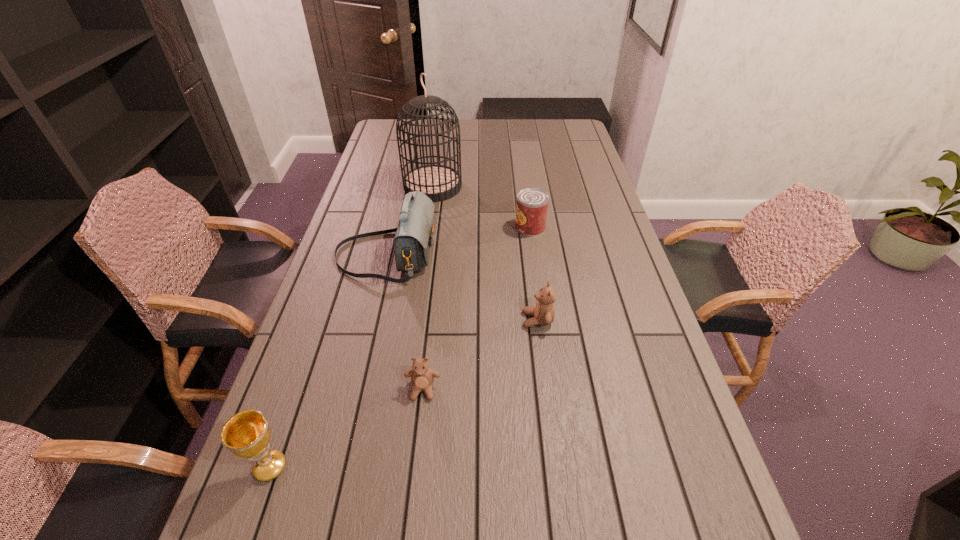
Locate an element on the screen. This screenshot has height=540, width=960. vacant space situated 0.210m on the front-facing side of the shortest object is located at coordinates (411, 499).

Find the location of a particular element. vacant space located on the front-facing side of the right teddy bear is located at coordinates (376, 320).

What are the coordinates of `vacant point located on the front-facing side of the right teddy bear` in the screenshot? It's located at [477, 320].

Where is `free region located on the front-facing side of the right teddy bear`? Image resolution: width=960 pixels, height=540 pixels. free region located on the front-facing side of the right teddy bear is located at coordinates (441, 320).

Find the location of `free point located on the back of the second tallest object`. free point located on the back of the second tallest object is located at coordinates (402, 187).

You are a GUI agent. You are given a task and a screenshot of the screen. Output one action in this format:
    pyautogui.click(x=<x>, y=<y>)
    Task: Click on the blank area located 0.120m on the right of the farthest object
    The width and height of the screenshot is (960, 540).
    Given the screenshot: What is the action you would take?
    pyautogui.click(x=493, y=186)

Locate an element on the screen. This screenshot has height=540, width=960. free space located on the right of the can is located at coordinates (593, 228).

This screenshot has width=960, height=540. I want to click on vacant space located 0.200m on the back of the nearest object, so click(304, 369).

Where is `object at the near edge`? The height and width of the screenshot is (540, 960). object at the near edge is located at coordinates (247, 434).

Find the location of a particular element. shoulder bag situated at the left edge is located at coordinates (413, 239).